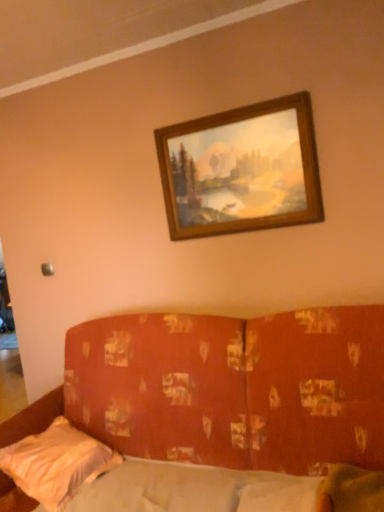
Question: Is wooden frame at upper center placed right next to textured orange fabric couch at center?

Choices:
 (A) yes
 (B) no

Answer: (B)

Question: Considering the relative sizes of wooden frame at upper center and textured orange fabric couch at center in the image provided, is wooden frame at upper center smaller than textured orange fabric couch at center?

Choices:
 (A) yes
 (B) no

Answer: (A)

Question: Would you say textured orange fabric couch at center is part of wooden frame at upper center's contents?

Choices:
 (A) no
 (B) yes

Answer: (A)

Question: Does wooden frame at upper center come in front of textured orange fabric couch at center?

Choices:
 (A) no
 (B) yes

Answer: (A)

Question: Is wooden frame at upper center thinner than textured orange fabric couch at center?

Choices:
 (A) yes
 (B) no

Answer: (A)

Question: Is wooden frame at upper center behind textured orange fabric couch at center?

Choices:
 (A) no
 (B) yes

Answer: (B)

Question: From a real-world perspective, is textured orange fabric couch at center positioned over wooden frame at upper center based on gravity?

Choices:
 (A) no
 (B) yes

Answer: (A)

Question: Is wooden frame at upper center inside textured orange fabric couch at center?

Choices:
 (A) no
 (B) yes

Answer: (A)

Question: From a real-world perspective, is textured orange fabric couch at center physically below wooden frame at upper center?

Choices:
 (A) no
 (B) yes

Answer: (B)

Question: Is textured orange fabric couch at center thinner than wooden frame at upper center?

Choices:
 (A) yes
 (B) no

Answer: (B)

Question: Is textured orange fabric couch at center oriented away from wooden frame at upper center?

Choices:
 (A) no
 (B) yes

Answer: (A)

Question: From the image's perspective, is textured orange fabric couch at center located beneath wooden frame at upper center?

Choices:
 (A) yes
 (B) no

Answer: (A)

Question: Is white satin pillow at lower left facing away from wooden frame at upper center?

Choices:
 (A) no
 (B) yes

Answer: (A)